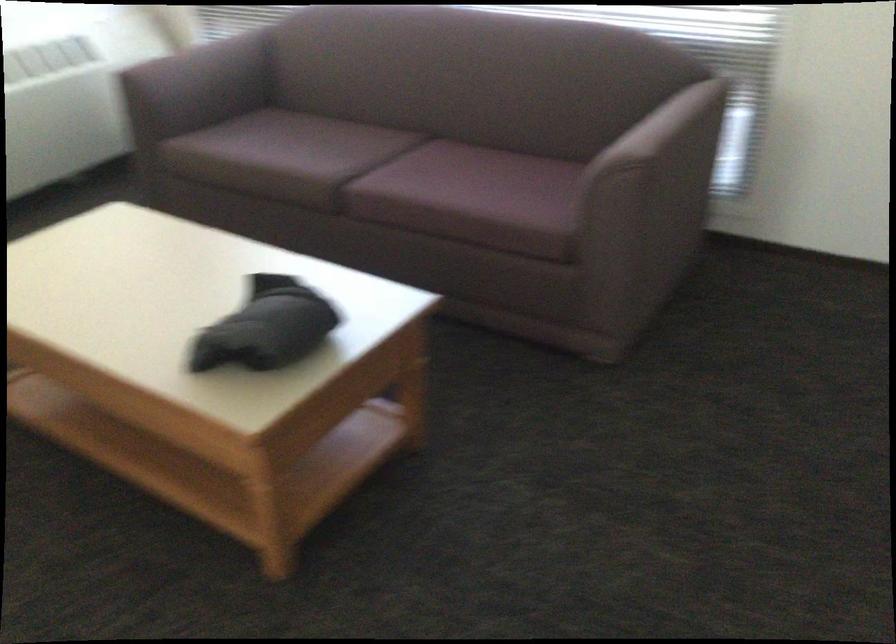
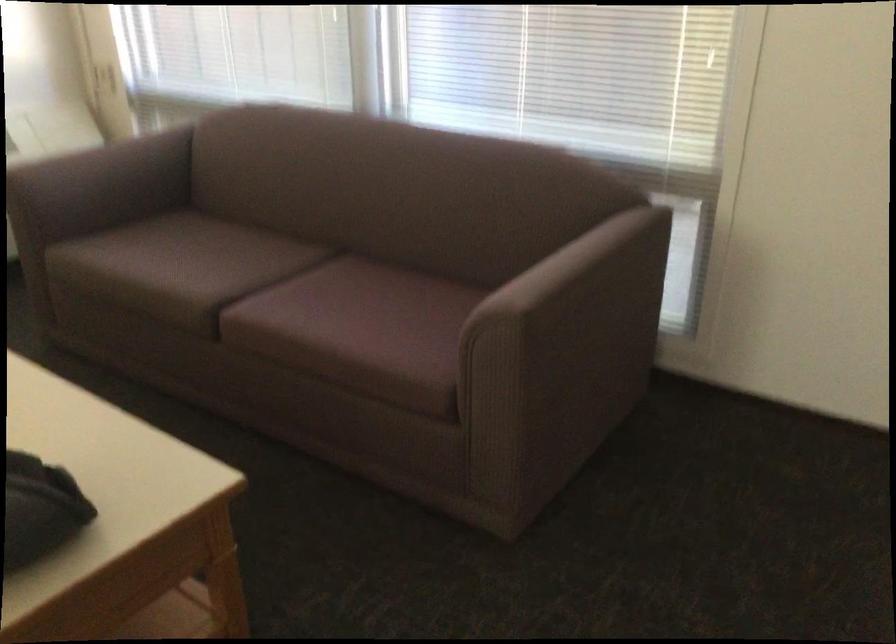
In the second image, find the point that corresponds to [202,70] in the first image.

(113, 173)